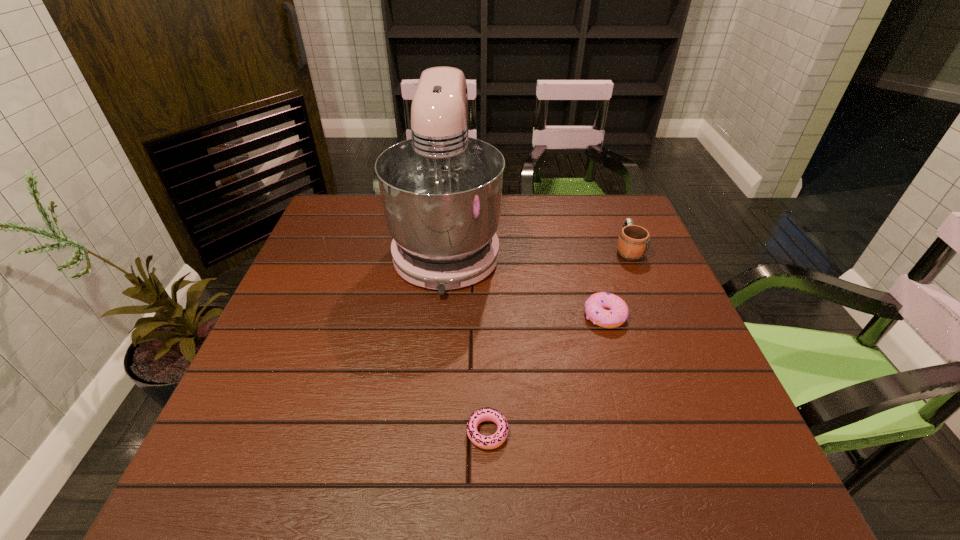
The height and width of the screenshot is (540, 960). I want to click on free area in between the tallest object and the nearest object, so click(x=468, y=339).

Locate an element on the screen. blank region between the farther doughnut and the tallest object is located at coordinates (526, 281).

The image size is (960, 540). I want to click on empty space that is in between the nearest object and the mixer, so click(468, 339).

At what (x,y) coordinates should I click in order to perform the action: click on the closest object to the mixer. Please return your answer as a coordinate pair (x, y). Image resolution: width=960 pixels, height=540 pixels. Looking at the image, I should click on (617, 312).

Identify which object is the nearest to the mixer. Please provide its 2D coordinates. Your answer should be formatted as a tuple, i.e. [(x, y)], where the tuple contains the x and y coordinates of a point satisfying the conditions above.

[(617, 312)]

At what (x,y) coordinates should I click in order to perform the action: click on blank space that satisfies the following two spatial constraints: 1. on the front-facing side of the taller doughnut; 2. on the left side of the tallest object. Please return your answer as a coordinate pair (x, y). Looking at the image, I should click on (441, 315).

Identify the location of free space in the image that satisfies the following two spatial constraints: 1. on the front-facing side of the right doughnut; 2. on the left side of the tallest object. (441, 315).

At what (x,y) coordinates should I click in order to perform the action: click on free location that satisfies the following two spatial constraints: 1. on the back side of the farther doughnut; 2. on the right side of the shortest object. Please return your answer as a coordinate pair (x, y). Looking at the image, I should click on (486, 315).